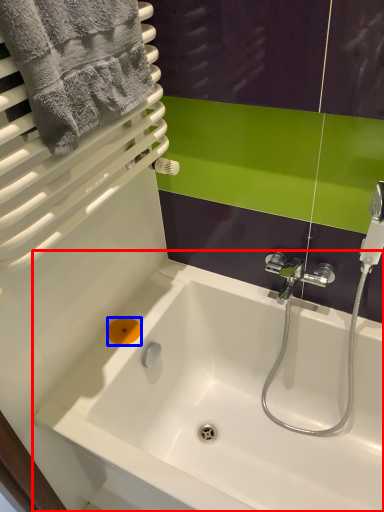
Question: Which of the following is the closest to the observer, bathtub (highlighted by a red box) or soap (highlighted by a blue box)?

Choices:
 (A) bathtub
 (B) soap

Answer: (A)